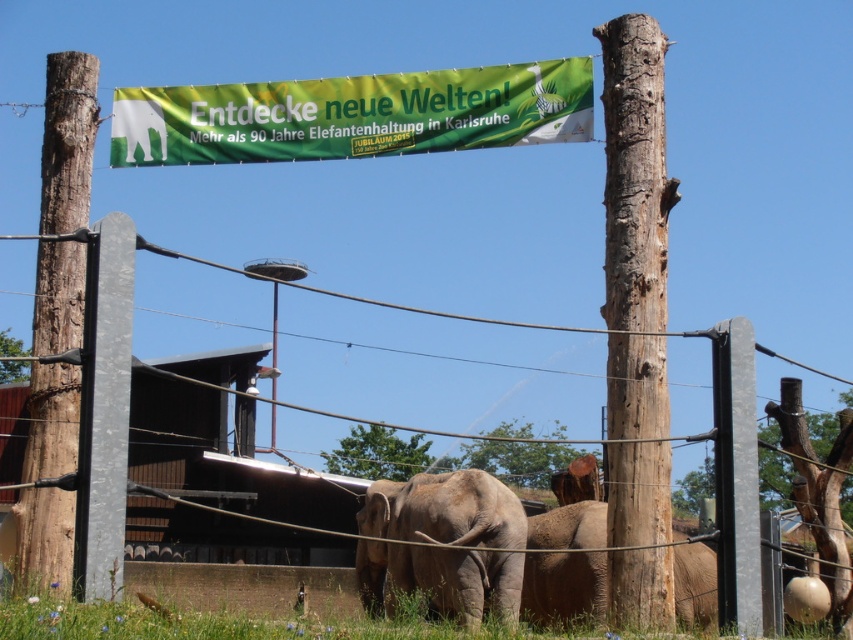
You are a zoo visitor standing in front of the elephant enclosure. You want to take a photo of the metal wire fence at center and the brown rough wood pole at left. Which object should you focus on first to ensure both are in clear view?

The metal wire fence at center is closer to the viewer than the brown rough wood pole at left. To ensure both are in clear view, focus on the metal wire fence at center first since it is closer, and the brown rough wood pole at left will naturally be in focus as it is further back.

You are a visitor at the zoo and want to take a photo of the green fabric banner at upper center. The zoo requires visitors to stay behind the visitor safety line marked at point 0.181 on the x axis. Are you standing at the correct x coordinate to take the photo?

The 2D location of the green fabric banner at upper center is at point (352, 115). Since the visitor safety line is at 0.181 on the x axis, you are at the correct x coordinate to take the photo.